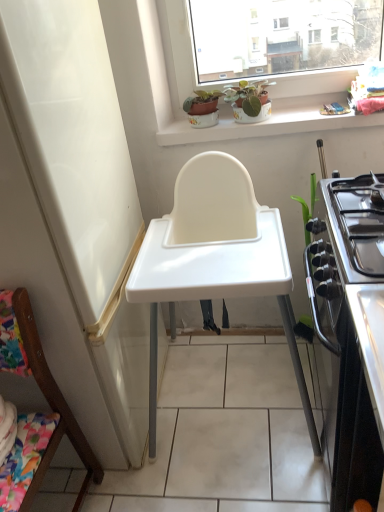
Question: Does white plastic highchair at center turn towards stainless steel stove at right?

Choices:
 (A) no
 (B) yes

Answer: (A)

Question: Can you confirm if white plastic highchair at center is taller than stainless steel stove at right?

Choices:
 (A) no
 (B) yes

Answer: (B)

Question: Is white plastic highchair at center at the right side of stainless steel stove at right?

Choices:
 (A) no
 (B) yes

Answer: (A)

Question: From the image's perspective, would you say white plastic highchair at center is shown under stainless steel stove at right?

Choices:
 (A) yes
 (B) no

Answer: (B)

Question: From a real-world perspective, is white plastic highchair at center beneath stainless steel stove at right?

Choices:
 (A) yes
 (B) no

Answer: (B)

Question: Does white plastic highchair at center have a lesser height compared to stainless steel stove at right?

Choices:
 (A) no
 (B) yes

Answer: (A)

Question: Can you confirm if green matte plant at upper center, marked as the 1th houseplant in a right-to-left arrangement, is positioned to the left of matte ceramic pot at upper center, which ranks as the first houseplant in left-to-right order?

Choices:
 (A) no
 (B) yes

Answer: (A)

Question: From the image's perspective, is green matte plant at upper center, marked as the 1th houseplant in a right-to-left arrangement, on matte ceramic pot at upper center, which ranks as the first houseplant in left-to-right order?

Choices:
 (A) no
 (B) yes

Answer: (A)

Question: From a real-world perspective, is green matte plant at upper center, acting as the 2th houseplant starting from the left, physically below matte ceramic pot at upper center, marked as the 2th houseplant in a right-to-left arrangement?

Choices:
 (A) yes
 (B) no

Answer: (B)

Question: Are green matte plant at upper center, acting as the 2th houseplant starting from the left, and matte ceramic pot at upper center, marked as the 2th houseplant in a right-to-left arrangement, making contact?

Choices:
 (A) yes
 (B) no

Answer: (B)

Question: Can you confirm if green matte plant at upper center, marked as the 1th houseplant in a right-to-left arrangement, is bigger than matte ceramic pot at upper center, which ranks as the first houseplant in left-to-right order?

Choices:
 (A) yes
 (B) no

Answer: (A)

Question: Is green matte plant at upper center, acting as the 2th houseplant starting from the left, to the right of matte ceramic pot at upper center, marked as the 2th houseplant in a right-to-left arrangement, from the viewer's perspective?

Choices:
 (A) yes
 (B) no

Answer: (A)

Question: Is matte ceramic pot at upper center, marked as the 2th houseplant in a right-to-left arrangement, taller than green matte plant at upper center, acting as the 2th houseplant starting from the left?

Choices:
 (A) yes
 (B) no

Answer: (B)